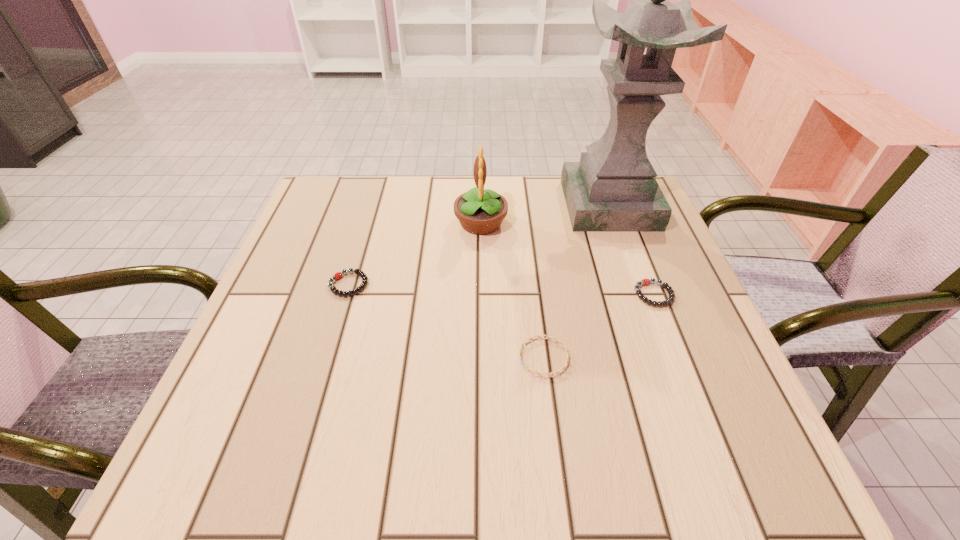
Locate an element on the screen. The width and height of the screenshot is (960, 540). sculpture is located at coordinates (613, 188).

The height and width of the screenshot is (540, 960). I want to click on the second object from left to right, so click(x=480, y=212).

At what (x,y) coordinates should I click in order to perform the action: click on sunflower. Please return your answer as a coordinate pair (x, y). Looking at the image, I should click on (480, 212).

Image resolution: width=960 pixels, height=540 pixels. I want to click on the leftmost object, so pos(338,275).

In order to click on the rightmost bracelet in this screenshot , I will do `click(645, 281)`.

Locate an element on the screen. This screenshot has height=540, width=960. the third object from left to right is located at coordinates (547, 337).

Image resolution: width=960 pixels, height=540 pixels. What are the coordinates of `the nearest object` in the screenshot? It's located at (547, 337).

Find the location of a particular element. This screenshot has width=960, height=540. free region located at the front opening of the sculpture is located at coordinates (625, 248).

Image resolution: width=960 pixels, height=540 pixels. Find the location of `free location located 0.200m on the face of the second object from left to right`. free location located 0.200m on the face of the second object from left to right is located at coordinates (374, 222).

Where is `vacant position located 0.150m on the face of the second object from left to right`? Image resolution: width=960 pixels, height=540 pixels. vacant position located 0.150m on the face of the second object from left to right is located at coordinates (395, 222).